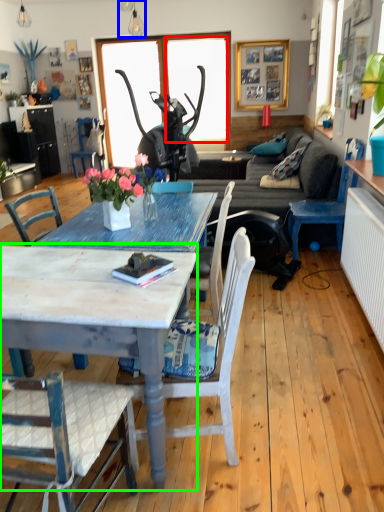
Question: Considering the real-world distances, which object is farthest from window screen (highlighted by a red box)? lamp (highlighted by a blue box) or coffee table (highlighted by a green box)?

Choices:
 (A) lamp
 (B) coffee table

Answer: (B)